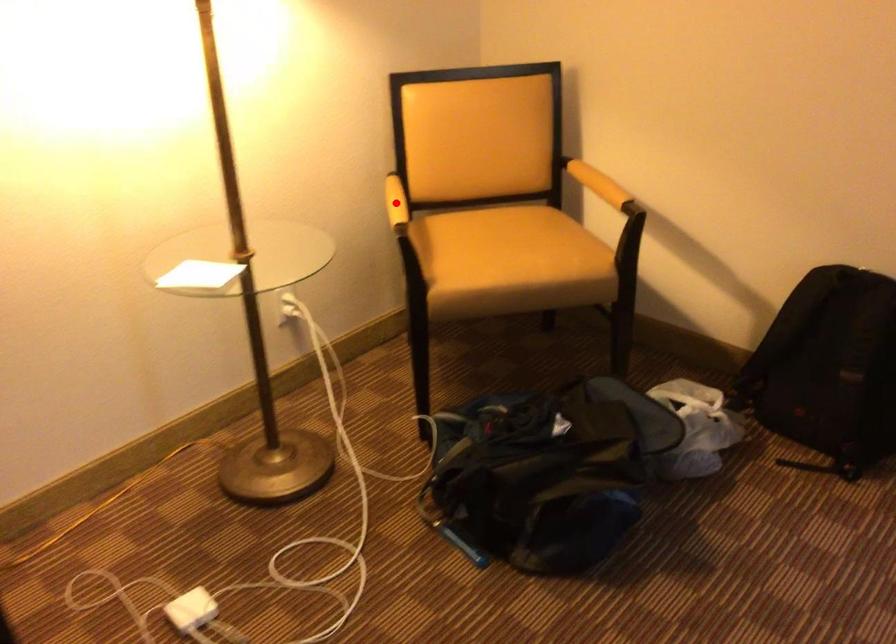
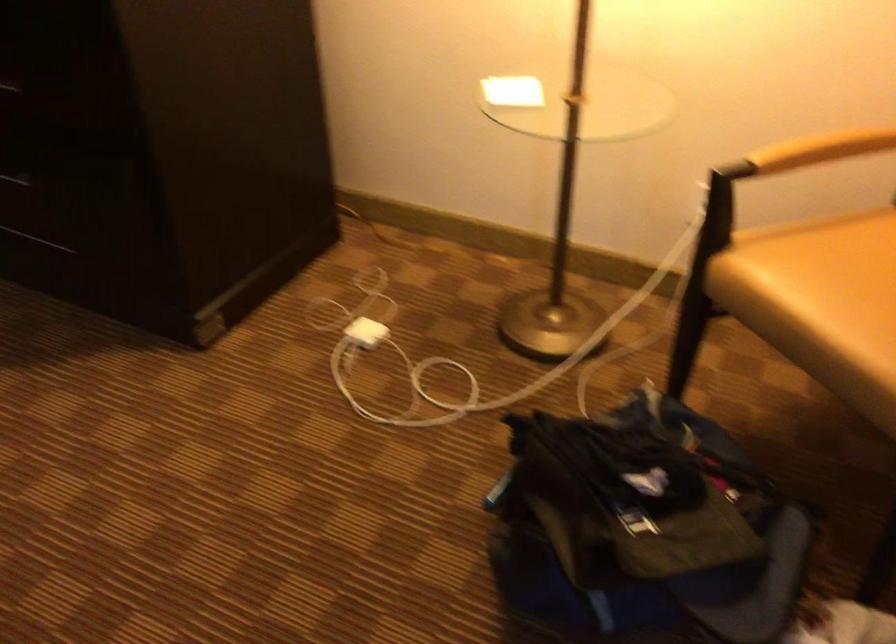
Where in the second image is the point corresponding to the highlighted location from the first image?

(788, 140)